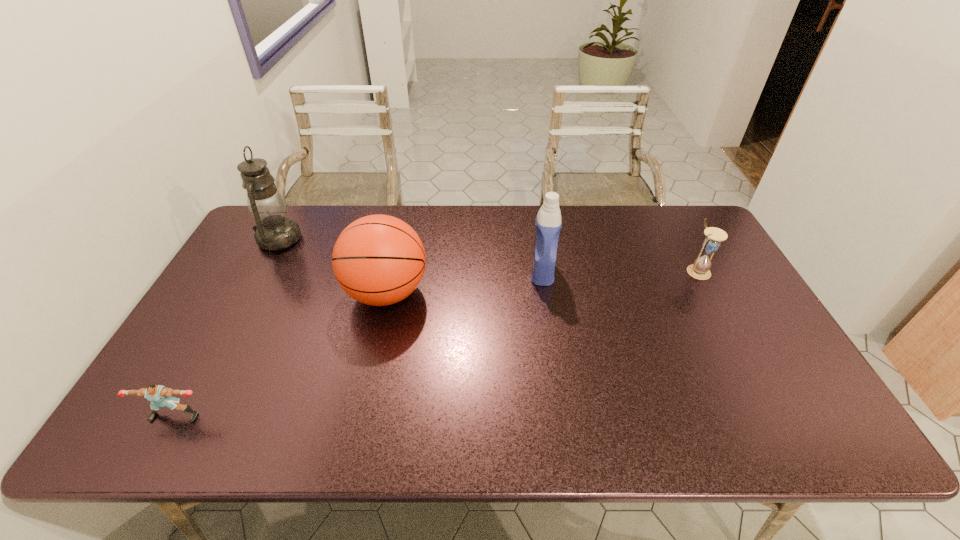
Where is `the tallest object`? This screenshot has width=960, height=540. the tallest object is located at coordinates (274, 231).

The image size is (960, 540). Identify the location of the second object from right to left. (548, 223).

You are a GUI agent. You are given a task and a screenshot of the screen. Output one action in this format:
    pyautogui.click(x=<x>, y=<y>)
    Task: Click on the basketball
    Image resolution: width=960 pixels, height=540 pixels.
    Given the screenshot: What is the action you would take?
    pyautogui.click(x=378, y=260)

Find the location of a particular element. the second shortest object is located at coordinates (700, 269).

This screenshot has width=960, height=540. In order to click on hourglass in this screenshot , I will do `click(700, 269)`.

Where is `puncher`? puncher is located at coordinates (160, 396).

The image size is (960, 540). I want to click on the shortest object, so coord(160,396).

Find the location of a particular element. This screenshot has height=540, width=960. vacant space located 0.130m on the right of the oil lamp is located at coordinates (340, 239).

Where is `vacant space located on the left of the detergent`? The height and width of the screenshot is (540, 960). vacant space located on the left of the detergent is located at coordinates (426, 272).

At what (x,y) coordinates should I click in order to perform the action: click on vacant space situated 0.310m on the left of the third object from left to right. Please return your answer as a coordinate pair (x, y). The width and height of the screenshot is (960, 540). Looking at the image, I should click on (238, 293).